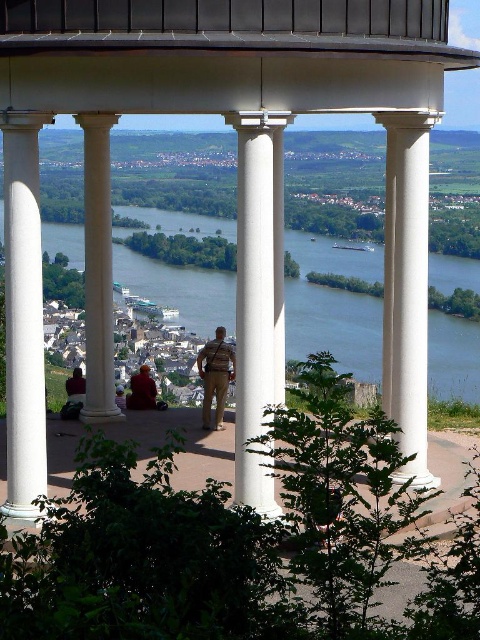
Question: Which point is farther to the camera?

Choices:
 (A) (74, 234)
 (B) (418, 301)
 (C) (154, 381)
 (D) (22, 122)

Answer: (A)

Question: Which of the following is the closest to the observer?

Choices:
 (A) (196, 358)
 (B) (75, 397)

Answer: (B)

Question: Can you confirm if white marble column at left is wider than tan fabric pants at center?

Choices:
 (A) no
 (B) yes

Answer: (B)

Question: Does white marble column at center have a larger size compared to light brown leather jacket at center?

Choices:
 (A) yes
 (B) no

Answer: (B)

Question: Is red shirt at center bigger than matte black jacket at lower left?

Choices:
 (A) no
 (B) yes

Answer: (B)

Question: Based on their relative distances, which object is farther from the white smooth column at center?

Choices:
 (A) white marble column at center
 (B) light brown leather jacket at center
 (C) tan fabric pants at center

Answer: (A)